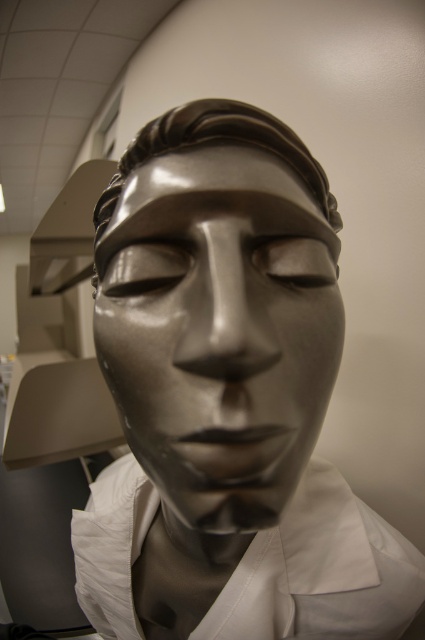
You are an art conservator examining the metallic sculpture. You notice two parts of the sculpture labeled as the shiny bronze mask at center and the shiny bronze forehead at center. Which part extends higher up the sculpture?

The shiny bronze mask at center extends higher up the sculpture than the shiny bronze forehead at center because it is taller.

You are an art conservator examining the shiny bronze mask at center in a gallery. You need to position a protective glass case around it. Where should you place the case to ensure it covers the mask exactly?

The shiny bronze mask at center is located at the coordinates point (218, 330), so the protective glass case should be centered at those coordinates to cover it precisely.

From the picture: You are an art conservator holding a 8 inch long tool. You need to clean the white matte dress shirt at center of the sculpture. Can you reach it with your tool without moving closer?

The white matte dress shirt at center is 9.25 inches away from the viewer. Since the tool is 8 inches long, it is not long enough to reach the shirt. You need a longer tool or move closer.